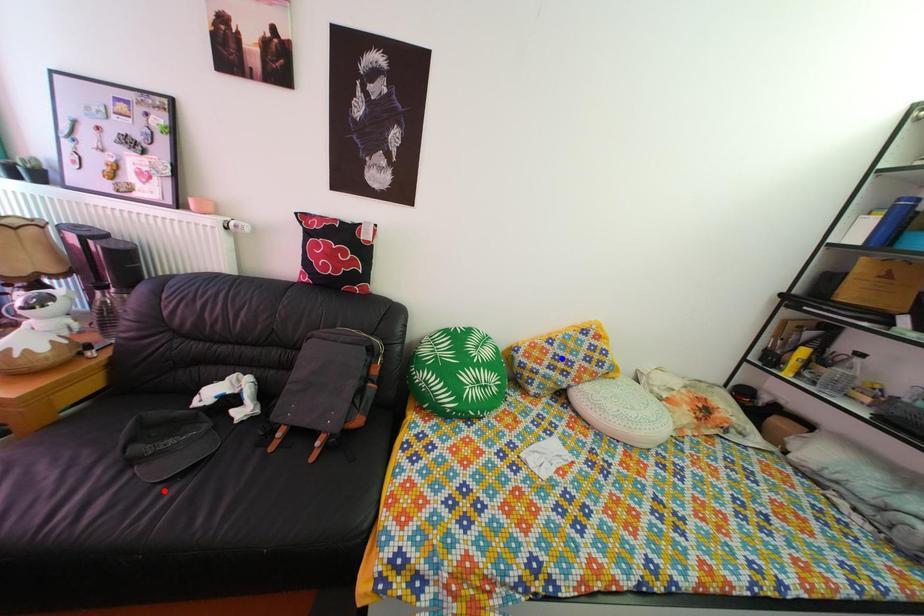
Question: Which of the two points in the image is closer to the camera?

Choices:
 (A) Blue point is closer.
 (B) Red point is closer.

Answer: (B)